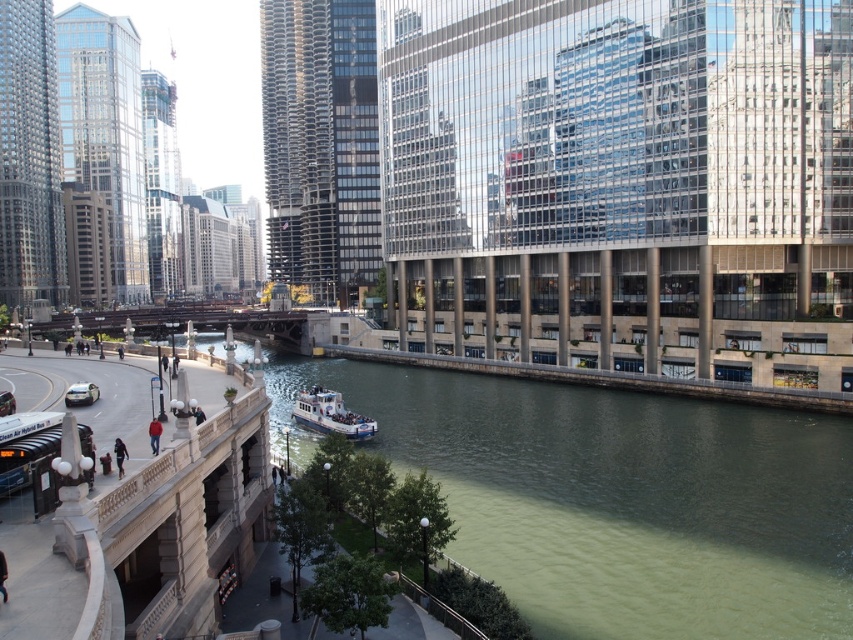
In the scene shown: You are a delivery driver needing to cross the river to reach a client on the other side. The white glossy boat at center is available for use. However, there is also a matte black car at lower left parked nearby. Which vehicle should you choose to reach the destination faster, and why?

You should choose the white glossy boat at center because it is positioned closer to the river, allowing you to cross directly. The matte black car at lower left is on the opposite side of the bridge and cannot traverse water.

You are a photographer planning to capture a wide shot of the cityscape with both the greenish water at center and the white glossy boat at center. Based on their sizes in the image, which one should you focus on to ensure it dominates the frame?

The greenish water at center is bigger than the white glossy boat at center, so focusing on the greenish water at center will ensure it dominates the frame.

In the scene shown: You are a pedestrian standing on the pedestrian bridge on the left side of the river. You see the greenish water at center and the matte black car at lower left. Which object is closer to your right side?

The greenish water at center is to the right of the matte black car at lower left, so from your position on the bridge, the greenish water at center would be closer to your right side.